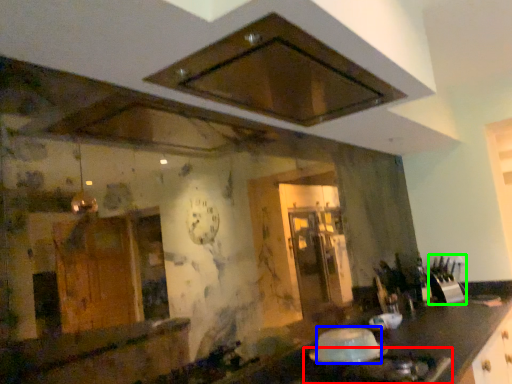
Question: Considering the real-world distances, which object is farthest from gas stove (highlighted by a red box)? food (highlighted by a blue box) or appliance (highlighted by a green box)?

Choices:
 (A) food
 (B) appliance

Answer: (B)